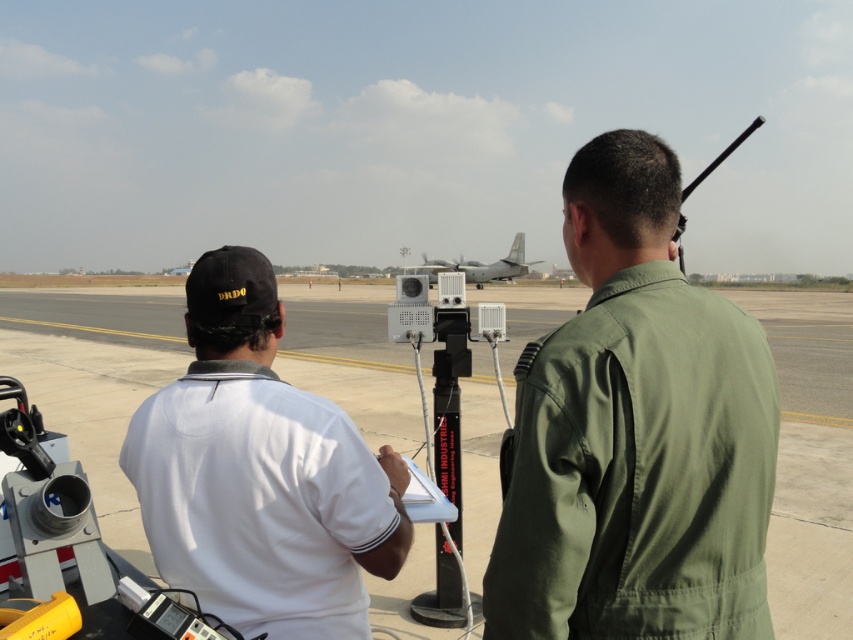
Between green fabric uniform at center and white matte shirt at left, which one is positioned higher?

green fabric uniform at center

Is green fabric uniform at center above white matte shirt at left?

Yes, green fabric uniform at center is above white matte shirt at left.

Where is `green fabric uniform at center`? Image resolution: width=853 pixels, height=640 pixels. green fabric uniform at center is located at coordinates (636, 433).

Where is `green fabric uniform at center`? Image resolution: width=853 pixels, height=640 pixels. green fabric uniform at center is located at coordinates (636, 433).

Is smooth concrete tarmac at center above white matte shirt at left?

Yes.

Is smooth concrete tarmac at center bigger than white matte shirt at left?

Correct, smooth concrete tarmac at center is larger in size than white matte shirt at left.

Between point (302, 365) and point (241, 340), which one is positioned behind?

The point (302, 365) is behind.

Locate an element on the screen. This screenshot has width=853, height=640. smooth concrete tarmac at center is located at coordinates (810, 460).

Between smooth concrete tarmac at center and gray matte airplane at center, which one appears on the right side from the viewer's perspective?

smooth concrete tarmac at center is more to the right.

Is smooth concrete tarmac at center shorter than gray matte airplane at center?

Indeed, smooth concrete tarmac at center has a lesser height compared to gray matte airplane at center.

Based on the photo, measure the distance between smooth concrete tarmac at center and camera.

The distance of smooth concrete tarmac at center from camera is 3.82 meters.

Identify the location of smooth concrete tarmac at center. (810, 460).